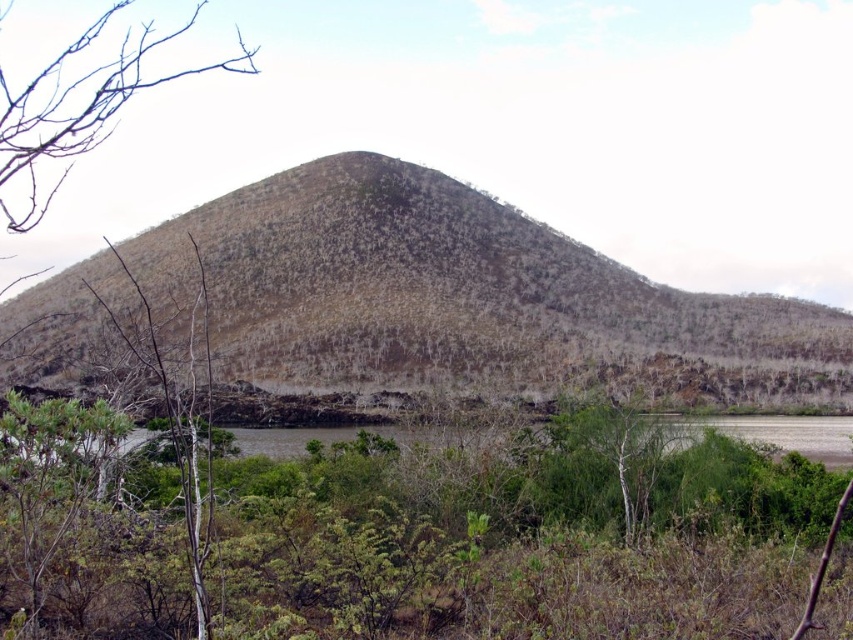
Question: Among these points, which one is nearest to the camera?

Choices:
 (A) (598, 428)
 (B) (137, 51)

Answer: (A)

Question: Does brown textured hill at center have a greater width compared to green leafy tree at center?

Choices:
 (A) yes
 (B) no

Answer: (A)

Question: Among these objects, which one is nearest to the camera?

Choices:
 (A) green leafy tree at center
 (B) brown textured hill at center
 (C) brown bark tree at upper left

Answer: (C)

Question: Which point is farther from the camera taking this photo?

Choices:
 (A) (555, 468)
 (B) (48, 289)
 (C) (247, 64)

Answer: (C)

Question: Can you confirm if brown bark tree at upper left is positioned above green leafy tree at center?

Choices:
 (A) no
 (B) yes

Answer: (B)

Question: Is the position of brown textured hill at center less distant than that of brown bark tree at upper left?

Choices:
 (A) no
 (B) yes

Answer: (A)